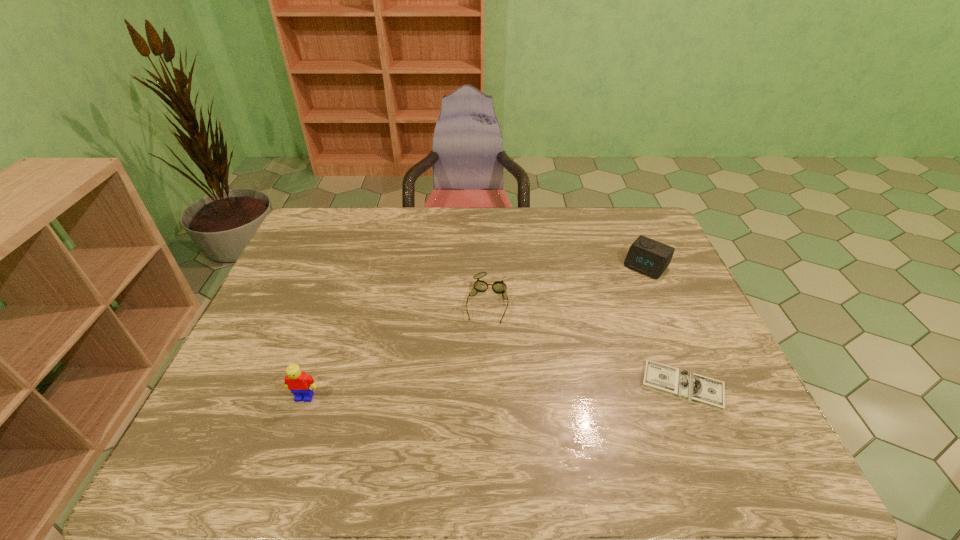
What are the coordinates of `vacant position located on the front-facing side of the third shortest object` in the screenshot? It's located at (583, 343).

At what (x,y) coordinates should I click in order to perform the action: click on vacant point located 0.290m on the front-facing side of the third shortest object. Please return your answer as a coordinate pair (x, y). This screenshot has width=960, height=540. Looking at the image, I should click on (589, 334).

Locate an element on the screen. free space located on the front-facing side of the third shortest object is located at coordinates (609, 310).

At what (x,y) coordinates should I click in order to perform the action: click on Lego that is at the near edge. Please return your answer as a coordinate pair (x, y). Looking at the image, I should click on [300, 384].

This screenshot has width=960, height=540. In order to click on dollar present at the near edge in this screenshot , I will do `click(709, 392)`.

Find the location of `dollar located in the right edge section of the desktop`. dollar located in the right edge section of the desktop is located at coordinates (709, 392).

Where is `alarm clock that is at the right edge`? This screenshot has height=540, width=960. alarm clock that is at the right edge is located at coordinates (646, 256).

The width and height of the screenshot is (960, 540). I want to click on object present at the near right corner, so click(709, 392).

In the image, there is a desktop. At what (x,y) coordinates should I click in order to perform the action: click on vacant space at the far edge. Please return your answer as a coordinate pair (x, y). Looking at the image, I should click on (351, 239).

The width and height of the screenshot is (960, 540). In order to click on vacant space at the near edge of the desktop in this screenshot , I will do `click(620, 402)`.